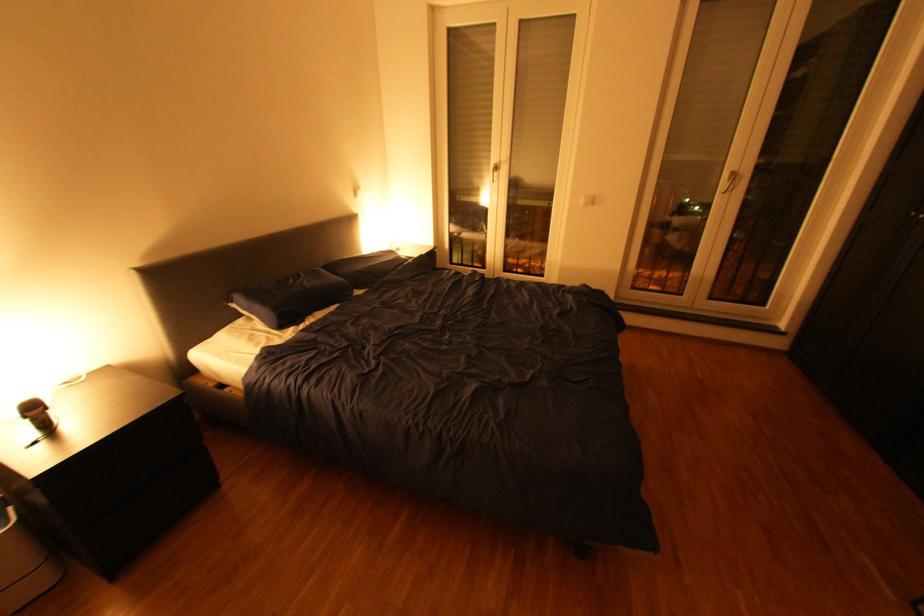
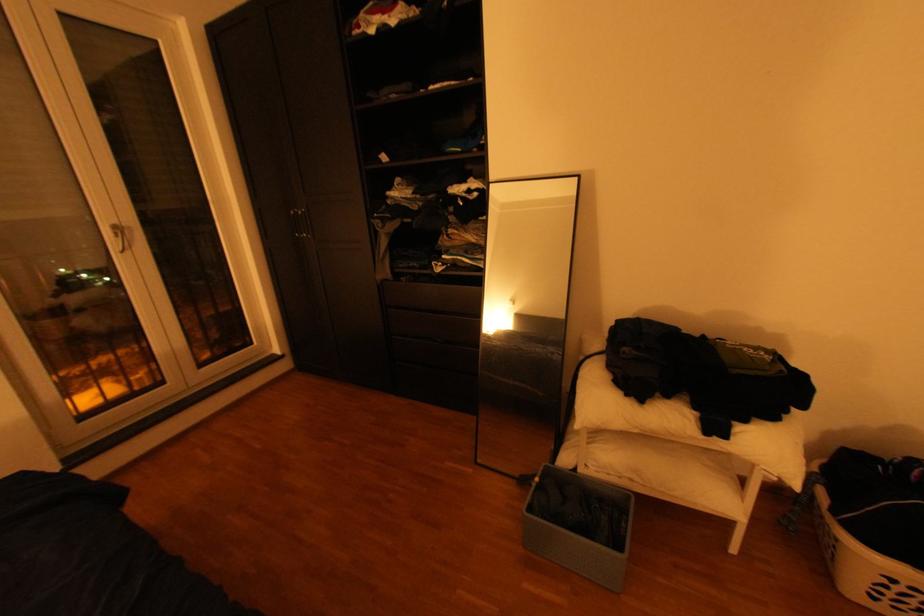
Find the pixel in the second image that matches (x=738, y=172) in the first image.

(117, 225)